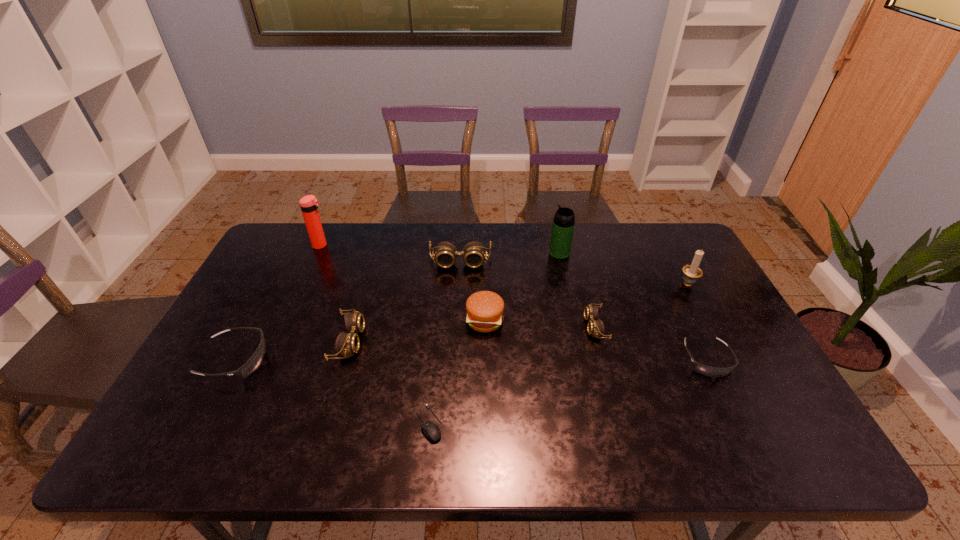
I want to click on the leftmost goggles, so click(254, 362).

Where is `the rightmost brown goggles`? The height and width of the screenshot is (540, 960). the rightmost brown goggles is located at coordinates (595, 327).

The image size is (960, 540). I want to click on the fourth goggles from left to right, so click(x=595, y=327).

Identify the location of the shortest goggles. (709, 371).

The height and width of the screenshot is (540, 960). In order to click on the ninth tallest object in this screenshot , I will do click(x=709, y=371).

Image resolution: width=960 pixels, height=540 pixels. In order to click on mouse in this screenshot , I will do `click(431, 430)`.

Identify the location of the nearest object. This screenshot has height=540, width=960. (431, 430).

In order to click on vacant region located on the right of the left thermos bottle in this screenshot , I will do `click(436, 245)`.

This screenshot has width=960, height=540. I want to click on vacant area situated from the spout of the right thermos bottle, so click(x=437, y=253).

Find the location of `vacant area located from the spout of the right thermos bottle`. vacant area located from the spout of the right thermos bottle is located at coordinates (467, 253).